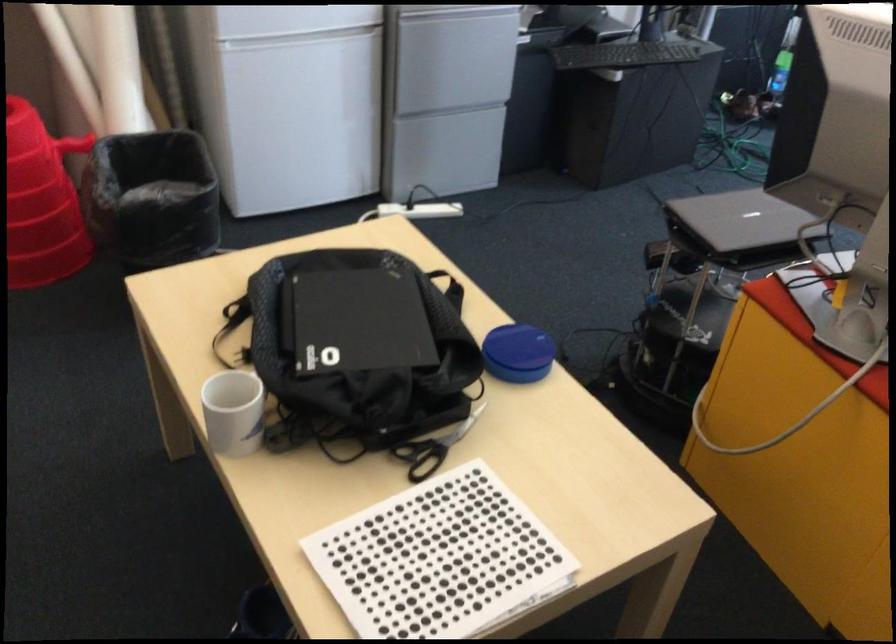
Find where to pull the refrigerator door handle. Please return your answer as a coordinate pair (x, y).

(298, 37)